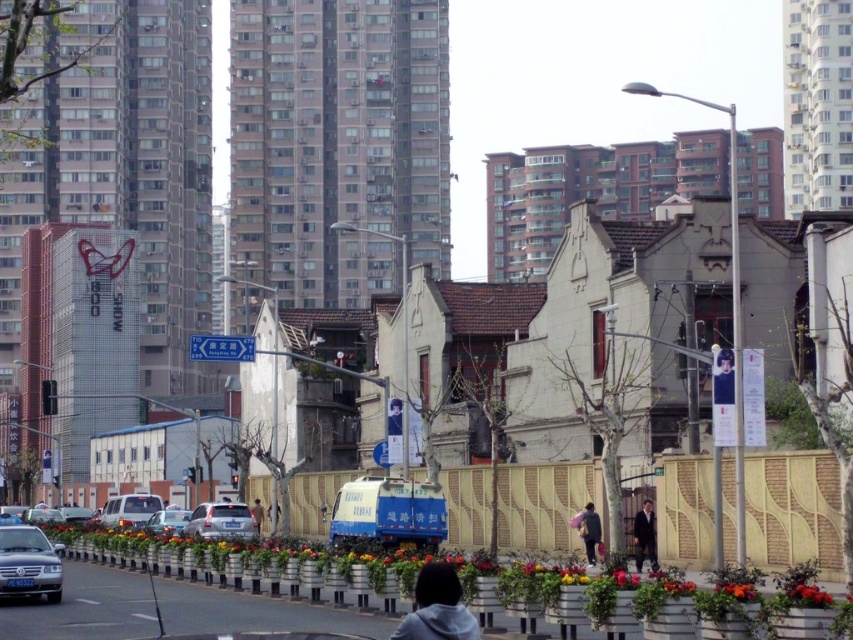
Can you confirm if gray hoodie at lower center is positioned above silver metallic sedan at lower left?

Yes.

Which is in front, point (479, 637) or point (7, 582)?

Point (479, 637) is in front.

The image size is (853, 640). What are the coordinates of `gray hoodie at lower center` in the screenshot? It's located at coord(437,608).

Does blue metallic truck at center come behind dark gray fabric coat at center?

No, blue metallic truck at center is in front of dark gray fabric coat at center.

Can you confirm if blue metallic truck at center is positioned to the right of dark gray fabric coat at center?

No, blue metallic truck at center is not to the right of dark gray fabric coat at center.

Does point (431, 497) lie in front of point (587, 556)?

Yes, it is.

The image size is (853, 640). Identify the location of blue metallic truck at center. [x=389, y=513].

Can you confirm if blue metallic truck at center is thinner than light brown leather jacket at center?

In fact, blue metallic truck at center might be wider than light brown leather jacket at center.

Which of these two, blue metallic truck at center or light brown leather jacket at center, stands shorter?

With less height is blue metallic truck at center.

At what (x,y) coordinates should I click in order to perform the action: click on blue metallic truck at center. Please return your answer as a coordinate pair (x, y). This screenshot has height=640, width=853. Looking at the image, I should click on (389, 513).

Identify the location of blue metallic truck at center. (389, 513).